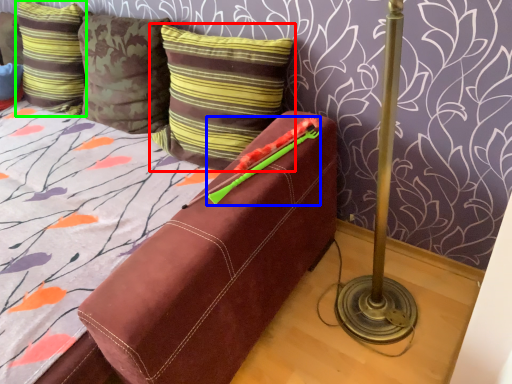
Question: Which is nearer to the pillow (highlighted by a red box)? crayon (highlighted by a blue box) or pillow (highlighted by a green box).

Choices:
 (A) crayon
 (B) pillow

Answer: (A)